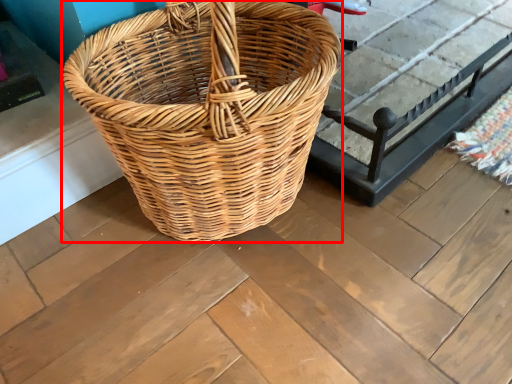
Question: From the image's perspective, what is the correct spatial positioning of picnic basket (annotated by the red box) in reference to table?

Choices:
 (A) below
 (B) above

Answer: (A)